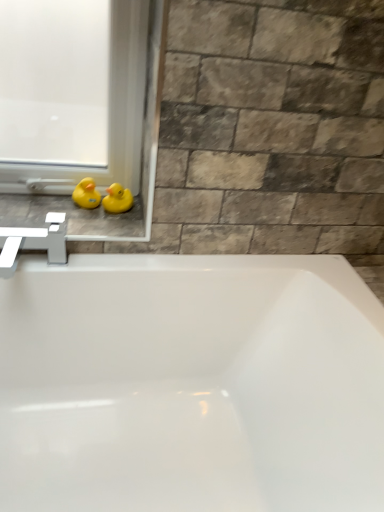
Locate an element on the screen. Image resolution: width=384 pixels, height=512 pixels. free space in front of yellow rubber duck at left, the 1th duck when ordered from left to right is located at coordinates (66, 221).